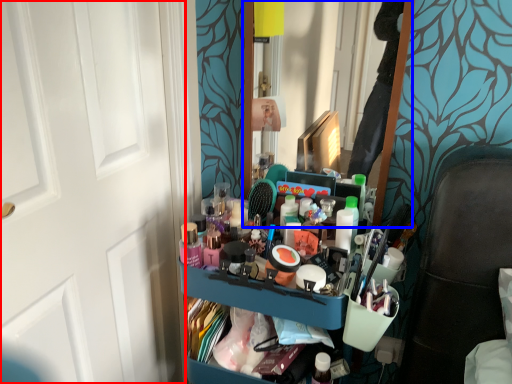
Question: Which of the following is the farthest to the observer, door (highlighted by a red box) or mirror (highlighted by a blue box)?

Choices:
 (A) door
 (B) mirror

Answer: (B)